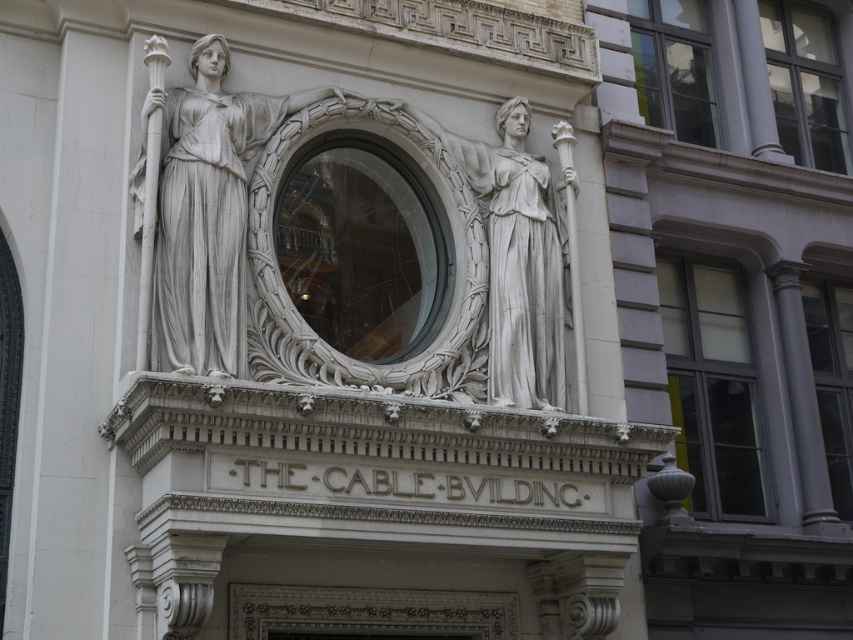
From the picture: You are standing in front of The Cable Building and want to take a photo of the white marble statue at center. Based on its position, where should you aim your camera to capture it in the frame?

The white marble statue at center is located at point coordinates 0.334 on the x and 0.239 on the y axis, so you should aim your camera slightly to the left and upper portion of the building facade to capture it in the frame.